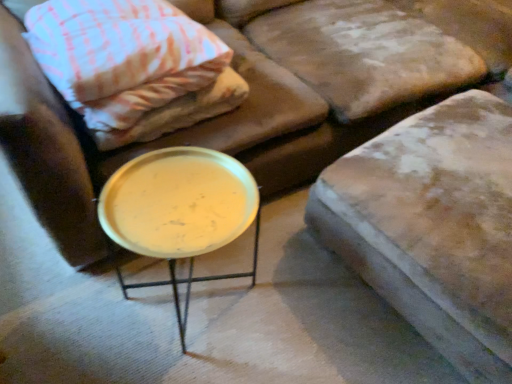
What is the approximate height of pink woven fabric pillow at upper left?

The height of pink woven fabric pillow at upper left is 24.65 centimeters.

The width and height of the screenshot is (512, 384). What are the coordinates of `pink woven fabric pillow at upper left` in the screenshot? It's located at [122, 56].

Which is more to the right, metallic gold tray at center or leather cushion at upper right?

leather cushion at upper right.

Does metallic gold tray at center contain leather cushion at upper right?

Definitely not — leather cushion at upper right is not inside metallic gold tray at center.

Can you tell me how much metallic gold tray at center and leather cushion at upper right differ in facing direction?

6.43 degrees separate the facing orientations of metallic gold tray at center and leather cushion at upper right.

Which of these two, metallic gold tray at center or leather cushion at upper right, is wider?

Wider between the two is leather cushion at upper right.

Is pink woven fabric pillow at upper left wider than metallic gold tray at center?

Correct, the width of pink woven fabric pillow at upper left exceeds that of metallic gold tray at center.

Is pink woven fabric pillow at upper left situated inside metallic gold tray at center or outside?

pink woven fabric pillow at upper left is not enclosed by metallic gold tray at center.

Which is in front, point (168, 47) or point (185, 282)?

The point (168, 47) is more forward.

Which is closer, [96,48] or [328,169]?

Point [96,48] appears to be closer to the viewer than point [328,169].

The image size is (512, 384). Find the location of `swivel chair below the pink woven fabric pillow at upper left (from a real-world perspective)`. swivel chair below the pink woven fabric pillow at upper left (from a real-world perspective) is located at coordinates (433, 226).

Which object is further away from the camera, pink woven fabric pillow at upper left or leather cushion at upper right?

pink woven fabric pillow at upper left is further from the camera.

From the image's perspective, between leather cushion at upper right and metallic gold tray at center, who is located below?

From the image's view, metallic gold tray at center is below.

How much distance is there between leather cushion at upper right and metallic gold tray at center?

leather cushion at upper right and metallic gold tray at center are 21.07 inches apart.

Can you confirm if leather cushion at upper right is positioned to the left of metallic gold tray at center?

Incorrect, leather cushion at upper right is not on the left side of metallic gold tray at center.

Which is behind, leather cushion at upper right or metallic gold tray at center?

metallic gold tray at center is behind.

From a real-world perspective, relative to pink woven fabric pillow at upper left, is metallic gold tray at center vertically above or below?

metallic gold tray at center is below pink woven fabric pillow at upper left.

Is metallic gold tray at center wider than pink woven fabric pillow at upper left?

Incorrect, the width of metallic gold tray at center does not surpass that of pink woven fabric pillow at upper left.

Does metallic gold tray at center lie behind pink woven fabric pillow at upper left?

No, the depth of metallic gold tray at center is less than that of pink woven fabric pillow at upper left.

Consider the image. Can you confirm if leather cushion at upper right is thinner than pink woven fabric pillow at upper left?

In fact, leather cushion at upper right might be wider than pink woven fabric pillow at upper left.

Is leather cushion at upper right oriented away from pink woven fabric pillow at upper left?

Yes.

Considering the sizes of leather cushion at upper right and pink woven fabric pillow at upper left in the image, is leather cushion at upper right bigger or smaller than pink woven fabric pillow at upper left?

In the image, leather cushion at upper right appears to be larger than pink woven fabric pillow at upper left.

Locate an element on the screen. swivel chair located underneath the metallic gold tray at center (from a real-world perspective) is located at coordinates point(433,226).

Where is `table below the pink woven fabric pillow at upper left (from the image's perspective)`? table below the pink woven fabric pillow at upper left (from the image's perspective) is located at coordinates (180, 211).

Which object lies further to the anchor point pink woven fabric pillow at upper left, metallic gold tray at center or leather cushion at upper right?

Among the two, leather cushion at upper right is located further to pink woven fabric pillow at upper left.

Which object lies nearer to the anchor point leather cushion at upper right, pink woven fabric pillow at upper left or metallic gold tray at center?

metallic gold tray at center is closer to leather cushion at upper right.

Estimate the real-world distances between objects in this image. Which object is closer to leather cushion at upper right, metallic gold tray at center or pink woven fabric pillow at upper left?

Among the two, metallic gold tray at center is located nearer to leather cushion at upper right.

From the image, which object appears to be nearer to metallic gold tray at center, pink woven fabric pillow at upper left or leather cushion at upper right?

The object closer to metallic gold tray at center is pink woven fabric pillow at upper left.

Considering their positions, is leather cushion at upper right positioned closer to pink woven fabric pillow at upper left than metallic gold tray at center?

metallic gold tray at center.

Based on their spatial positions, is leather cushion at upper right or pink woven fabric pillow at upper left further from metallic gold tray at center?

The object further to metallic gold tray at center is leather cushion at upper right.

The image size is (512, 384). I want to click on table located between pink woven fabric pillow at upper left and leather cushion at upper right in the left-right direction, so click(x=180, y=211).